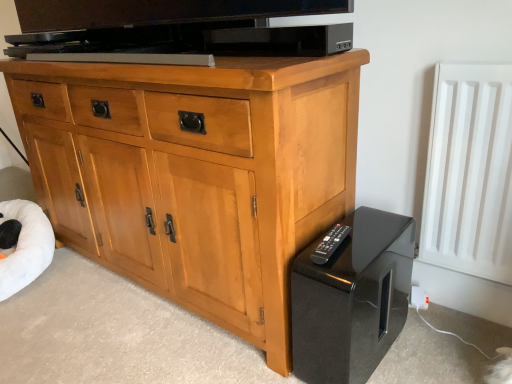
The height and width of the screenshot is (384, 512). In order to click on free point to the right of white plush bean bag at lower left in this screenshot , I will do tap(88, 286).